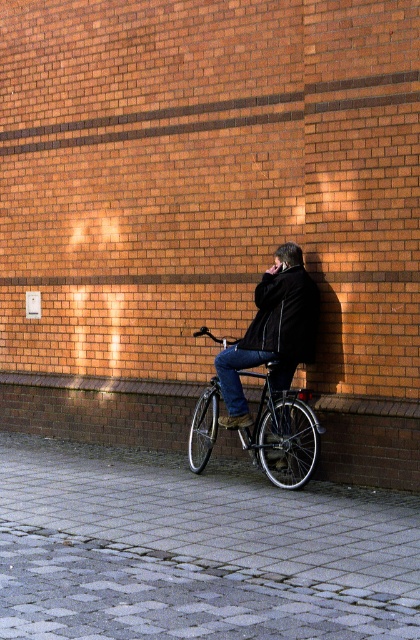
You are standing in front of a brick wall with a paved area in front of it. You see a dark wool coat at center and a black matte jacket at center. Which one is closer to the ground?

The dark wool coat at center is closer to the ground because it is below the black matte jacket at center.

Consider the image. You are standing at the origin of a coordinate system placed at the bottom left corner of the image. You see two points labeled as point (293, 280) and point (302, 337). Which point is closer to the brick wall in the background?

Point (293, 280) is behind point (302, 337), so it is closer to the brick wall in the background.